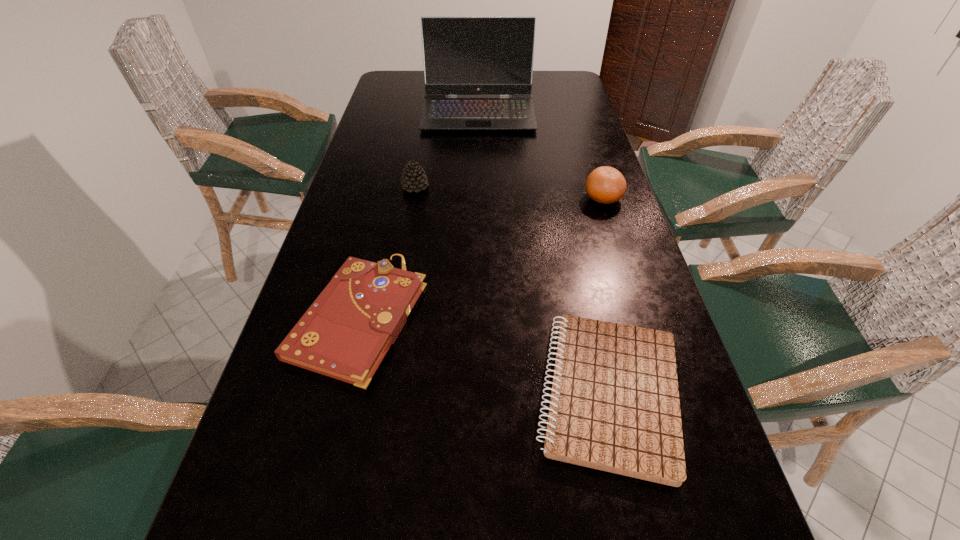
You are a GUI agent. You are given a task and a screenshot of the screen. Output one action in this format:
    pyautogui.click(x=<x>, y=<y>)
    Task: Click on the tallest object
    
    Given the screenshot: What is the action you would take?
    pyautogui.click(x=462, y=55)

The image size is (960, 540). I want to click on the farthest object, so click(x=462, y=55).

Where is `clementine`? This screenshot has height=540, width=960. clementine is located at coordinates (605, 185).

Where is `pinecone`? pinecone is located at coordinates (413, 178).

At what (x,y) coordinates should I click in order to perform the action: click on the taller notebook. Please return your answer as a coordinate pair (x, y). Looking at the image, I should click on (345, 334).

Locate an element on the screen. The width and height of the screenshot is (960, 540). the fourth tallest object is located at coordinates (345, 334).

The width and height of the screenshot is (960, 540). What are the coordinates of `the shortest object` in the screenshot? It's located at (614, 406).

Identify the location of the shorter notebook. Image resolution: width=960 pixels, height=540 pixels. (614, 406).

Locate an element on the screen. The width and height of the screenshot is (960, 540). vacant region located on the screen of the tallest object is located at coordinates (478, 173).

Locate an element on the screen. free space located on the front of the clementine is located at coordinates (625, 267).